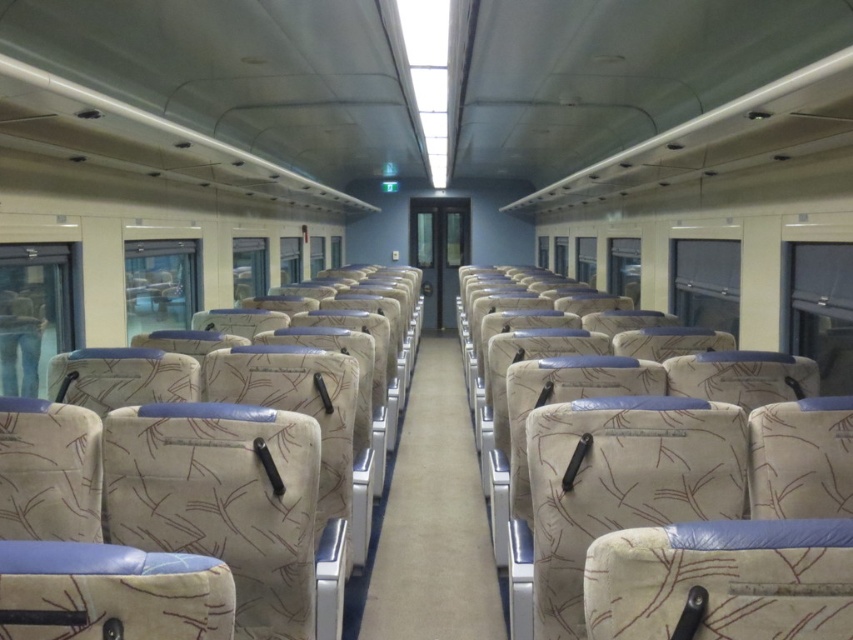
Question: Is beige fabric aisle at center to the right of denim jeans at left from the viewer's perspective?

Choices:
 (A) yes
 (B) no

Answer: (A)

Question: Which point is closer to the camera?

Choices:
 (A) denim jeans at left
 (B) beige fabric aisle at center

Answer: (B)

Question: Is beige fabric aisle at center positioned at the back of denim jeans at left?

Choices:
 (A) no
 (B) yes

Answer: (A)

Question: Which point is farther to the camera?

Choices:
 (A) beige fabric aisle at center
 (B) denim jeans at left

Answer: (B)

Question: Is beige fabric aisle at center to the right of denim jeans at left from the viewer's perspective?

Choices:
 (A) no
 (B) yes

Answer: (B)